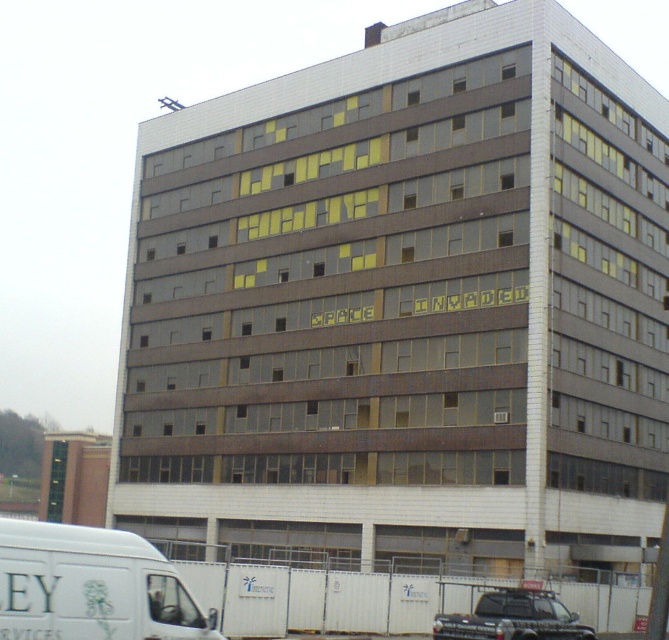
Find the location of a particular element. This screenshot has height=640, width=669. white matte van at lower left is located at coordinates (92, 586).

Who is lower down, white matte van at lower left or black matte truck at lower right?

black matte truck at lower right is below.

This screenshot has width=669, height=640. Identify the location of white matte van at lower left. (92, 586).

Locate an element on the screen. This screenshot has width=669, height=640. white matte van at lower left is located at coordinates (92, 586).